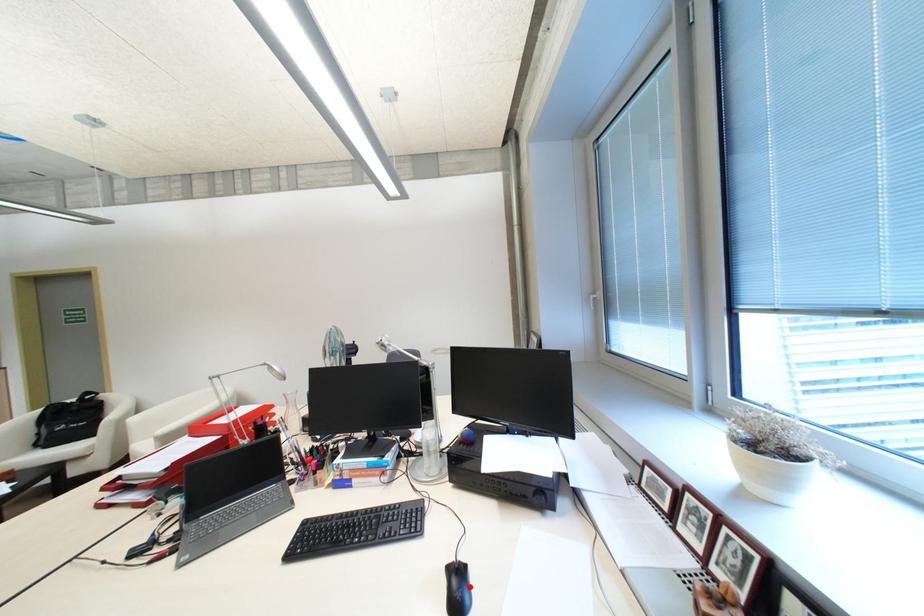
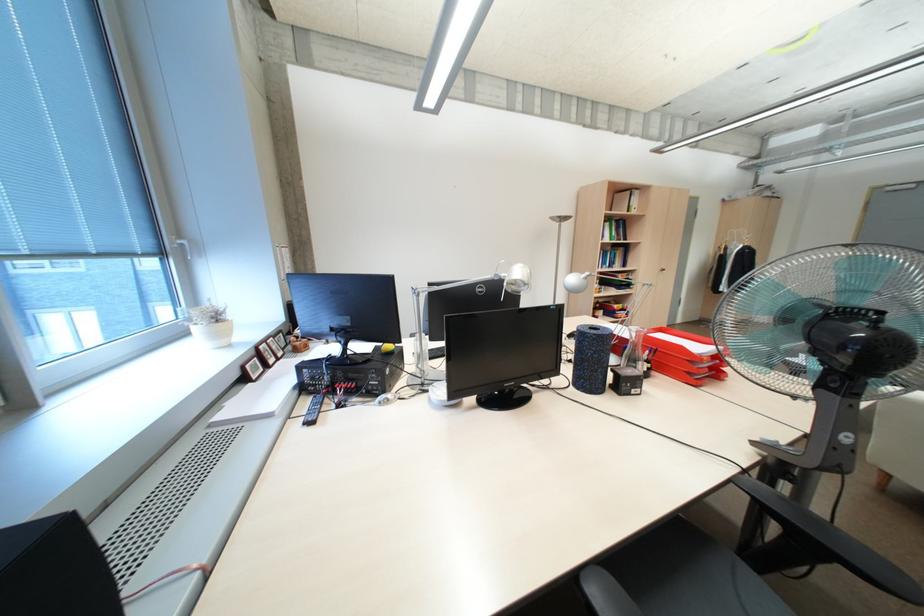
Question: I am providing you with two images of the same scene from different viewpoints. A red point is marked on the first image. At the location where the point appears in image 1, is it still visible in image 2?

Choices:
 (A) Yes
 (B) No

Answer: (B)